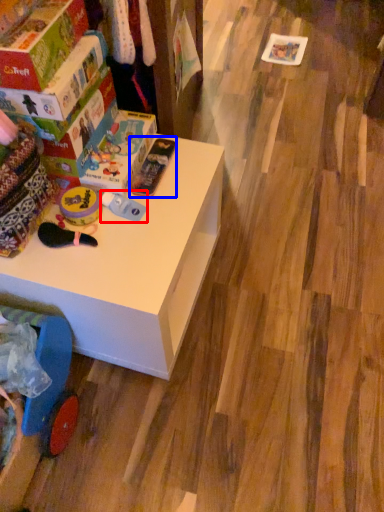
Question: Which object appears farthest to the camera in this image, toy (highlighted by a red box) or toy (highlighted by a blue box)?

Choices:
 (A) toy
 (B) toy

Answer: (B)